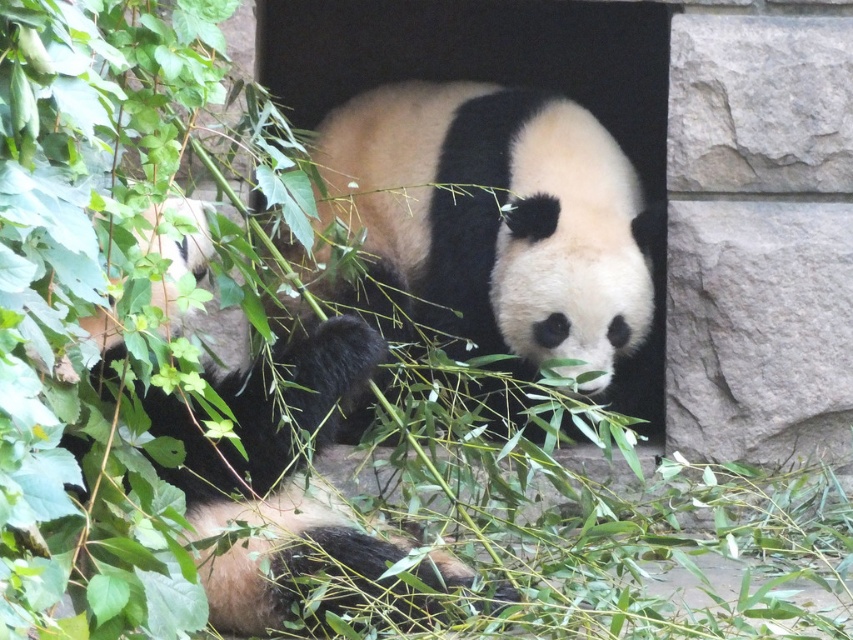
Question: Can you confirm if black fuzzy panda at center is wider than black and white fur panda at center?

Choices:
 (A) yes
 (B) no

Answer: (A)

Question: Which point is farther to the camera?

Choices:
 (A) black and white fur panda at center
 (B) black fuzzy panda at center

Answer: (B)

Question: Which object appears farthest from the camera in this image?

Choices:
 (A) black fuzzy panda at center
 (B) black and white fur panda at center

Answer: (A)

Question: Which point is closer to the camera?

Choices:
 (A) black fuzzy panda at center
 (B) black and white fur panda at center

Answer: (B)

Question: Can you confirm if black fuzzy panda at center is positioned to the right of black and white fur panda at center?

Choices:
 (A) no
 (B) yes

Answer: (B)

Question: Does black fuzzy panda at center appear over black and white fur panda at center?

Choices:
 (A) no
 (B) yes

Answer: (B)